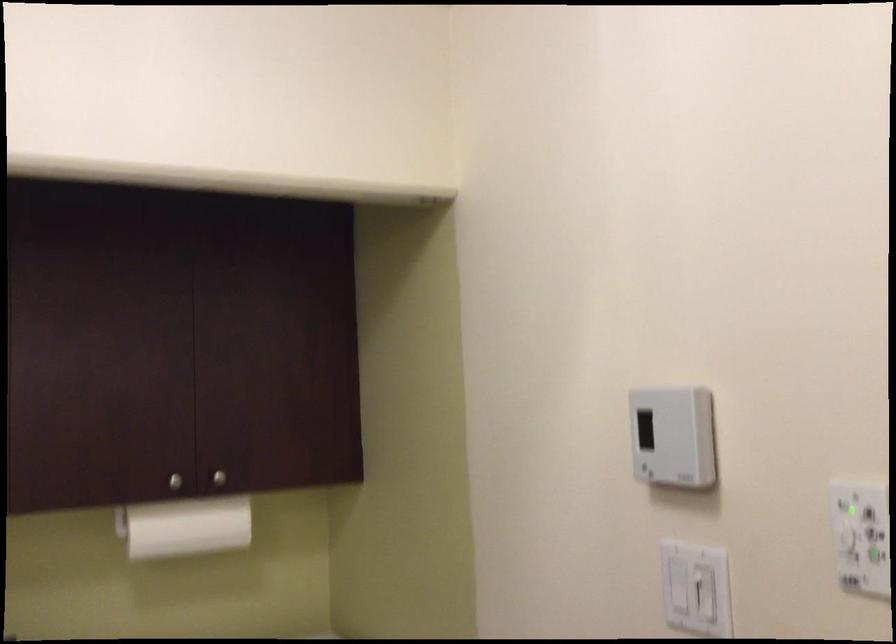
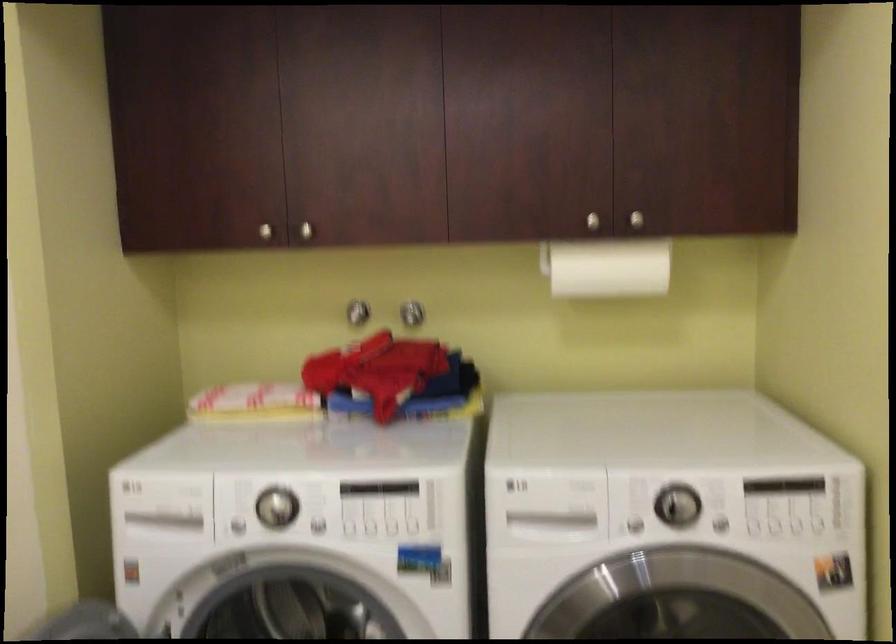
Question: The first image is from the beginning of the video and the second image is from the end. How did the camera likely rotate when shooting the video?

Choices:
 (A) Left
 (B) Right
 (C) Up
 (D) Down

Answer: (A)